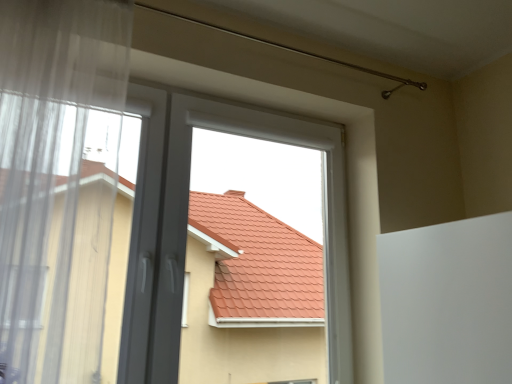
Question: From a real-world perspective, is white plastic window at center positioned above or below transparent fabric at left?

Choices:
 (A) above
 (B) below

Answer: (B)

Question: Is white plastic window at center taller or shorter than transparent fabric at left?

Choices:
 (A) short
 (B) tall

Answer: (A)

Question: Is white plastic window at center spatially inside transparent fabric at left, or outside of it?

Choices:
 (A) outside
 (B) inside

Answer: (A)

Question: In terms of height, does transparent fabric at left look taller or shorter compared to white plastic window at center?

Choices:
 (A) tall
 (B) short

Answer: (A)

Question: From the image's perspective, relative to white plastic window at center, is transparent fabric at left above or below?

Choices:
 (A) below
 (B) above

Answer: (B)

Question: Do you think transparent fabric at left is within white plastic window at center, or outside of it?

Choices:
 (A) inside
 (B) outside

Answer: (B)

Question: Looking at their shapes, would you say transparent fabric at left is wider or thinner than white plastic window at center?

Choices:
 (A) wide
 (B) thin

Answer: (A)